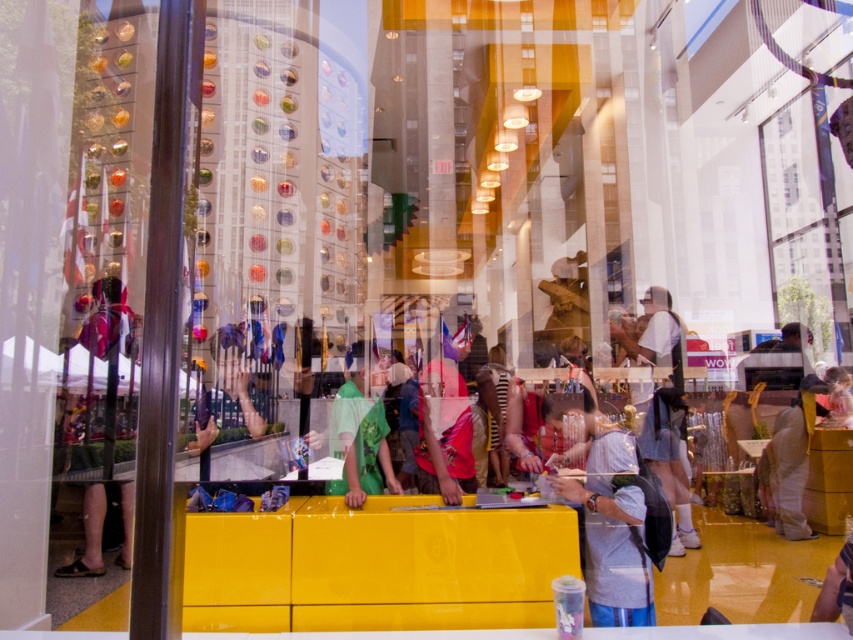
Which is above, green matte shirt at center or light brown fabric pants at center?

green matte shirt at center is above.

Can you confirm if green matte shirt at center is positioned below light brown fabric pants at center?

Incorrect, green matte shirt at center is not positioned below light brown fabric pants at center.

What do you see at coordinates (360, 435) in the screenshot?
I see `green matte shirt at center` at bounding box center [360, 435].

Find the location of a particular element. This screenshot has width=853, height=640. green matte shirt at center is located at coordinates (360, 435).

Which of these two, matte gray backpack at lower right or green matte shirt at center, stands shorter?

With less height is green matte shirt at center.

Can you confirm if matte gray backpack at lower right is wider than green matte shirt at center?

No, matte gray backpack at lower right is not wider than green matte shirt at center.

Does point (635, 488) come in front of point (349, 372)?

Yes.

Locate an element on the screen. The height and width of the screenshot is (640, 853). matte gray backpack at lower right is located at coordinates (605, 512).

The height and width of the screenshot is (640, 853). Describe the element at coordinates (360, 435) in the screenshot. I see `green matte shirt at center` at that location.

Does green matte shirt at center appear under denim jacket at lower right?

No, green matte shirt at center is not below denim jacket at lower right.

Which is in front, point (358, 368) or point (670, 509)?

Point (670, 509) is in front.

Find the location of `green matte shirt at center`. green matte shirt at center is located at coordinates (360, 435).